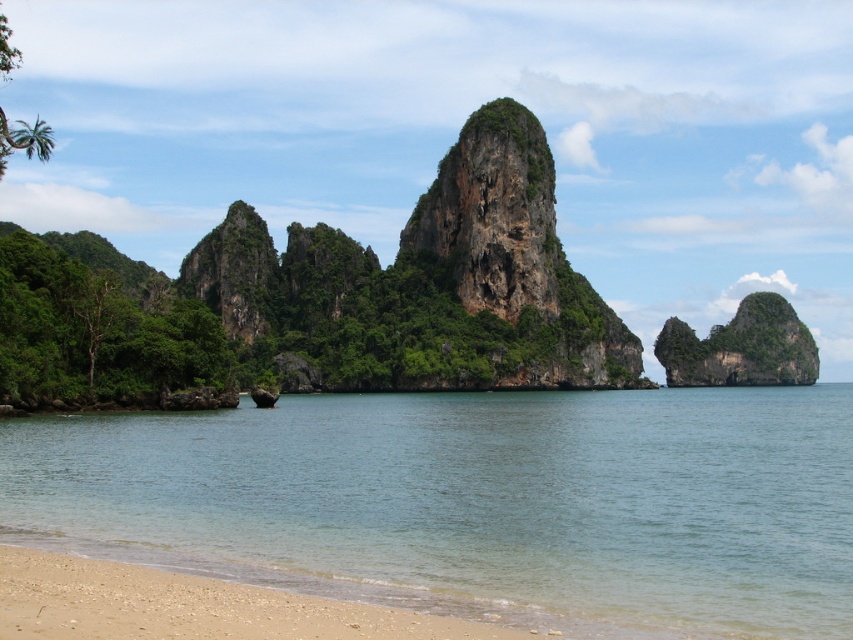
Can you confirm if clear water at lower left is positioned to the left of light brown gravel at lower left?

In fact, clear water at lower left is to the right of light brown gravel at lower left.

What are the coordinates of `clear water at lower left` in the screenshot? It's located at (474, 502).